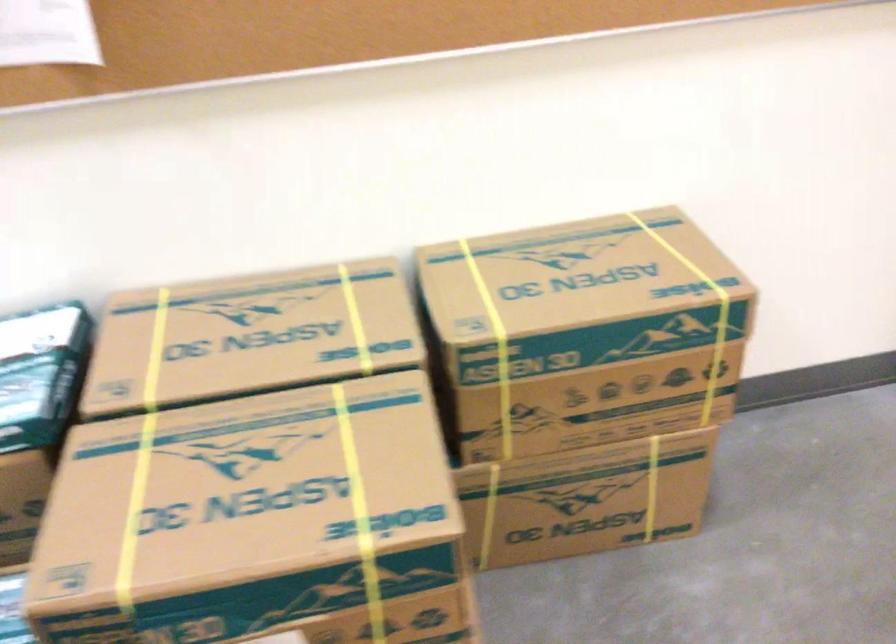
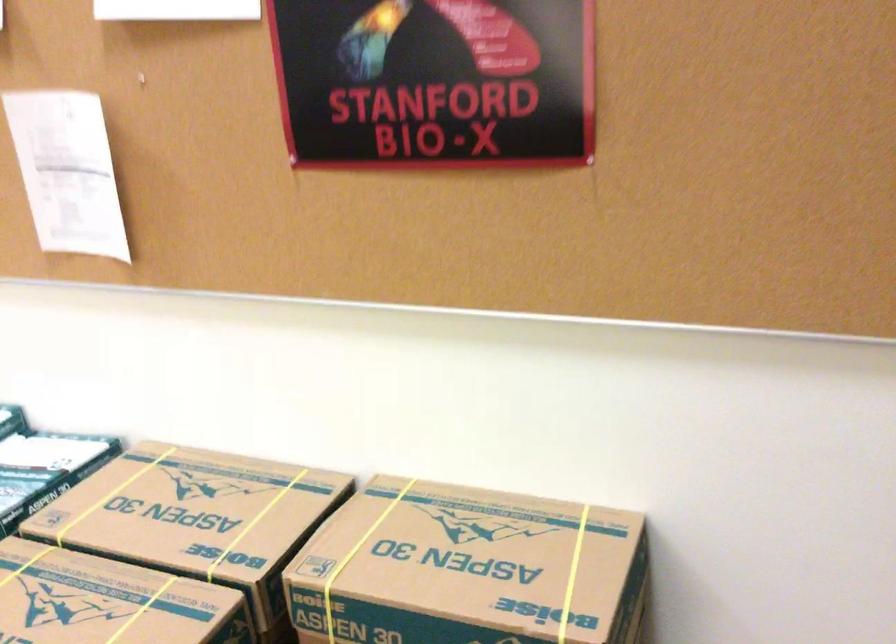
Question: The camera is either moving clockwise (left) or counter-clockwise (right) around the object. The first image is from the beginning of the video and the second image is from the end. Is the camera moving left or right when shooting the video?

Choices:
 (A) Left
 (B) Right

Answer: (B)